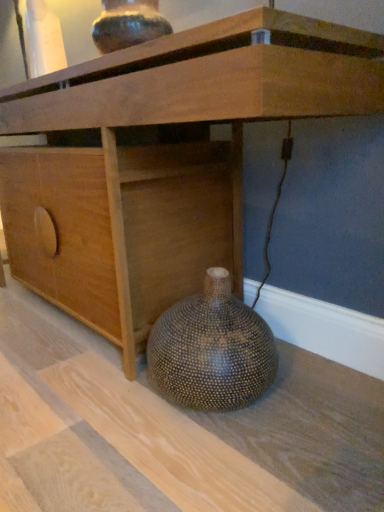
Question: Is speckled ceramic vase at upper center, which is the first vase from top to bottom, outside wooden cabinet at lower center?

Choices:
 (A) no
 (B) yes

Answer: (B)

Question: From the image's perspective, is speckled ceramic vase at upper center, which is the first vase from top to bottom, above wooden cabinet at lower center?

Choices:
 (A) no
 (B) yes

Answer: (B)

Question: Considering the relative sizes of speckled ceramic vase at upper center, the 2th vase when ordered from bottom to top, and wooden cabinet at lower center in the image provided, is speckled ceramic vase at upper center, the 2th vase when ordered from bottom to top, smaller than wooden cabinet at lower center?

Choices:
 (A) no
 (B) yes

Answer: (B)

Question: Is speckled ceramic vase at upper center, which is the first vase from top to bottom, positioned in front of wooden cabinet at lower center?

Choices:
 (A) yes
 (B) no

Answer: (B)

Question: Considering the relative positions of speckled ceramic vase at upper center, which is the first vase from top to bottom, and wooden cabinet at lower center in the image provided, is speckled ceramic vase at upper center, which is the first vase from top to bottom, to the right of wooden cabinet at lower center from the viewer's perspective?

Choices:
 (A) yes
 (B) no

Answer: (A)

Question: Is wooden cabinet at lower center to the left or to the right of speckled ceramic vase at upper center, which is the first vase from top to bottom, in the image?

Choices:
 (A) right
 (B) left

Answer: (B)

Question: Based on their sizes in the image, would you say wooden cabinet at lower center is bigger or smaller than speckled ceramic vase at upper center, which is the first vase from top to bottom?

Choices:
 (A) small
 (B) big

Answer: (B)

Question: From a real-world perspective, relative to speckled ceramic vase at upper center, the 2th vase when ordered from bottom to top, is wooden cabinet at lower center vertically above or below?

Choices:
 (A) above
 (B) below

Answer: (B)

Question: From the image's perspective, is wooden cabinet at lower center positioned above or below speckled ceramic vase at upper center, which is the first vase from top to bottom?

Choices:
 (A) below
 (B) above

Answer: (A)

Question: Based on their positions, is brown textured vase at lower right, the 1th vase in the bottom-to-top sequence, located to the left or right of speckled ceramic vase at upper center, the 2th vase when ordered from bottom to top?

Choices:
 (A) right
 (B) left

Answer: (A)

Question: Considering the positions of brown textured vase at lower right, which ranks as the 2th vase in top-to-bottom order, and speckled ceramic vase at upper center, the 2th vase when ordered from bottom to top, in the image, is brown textured vase at lower right, which ranks as the 2th vase in top-to-bottom order, taller or shorter than speckled ceramic vase at upper center, the 2th vase when ordered from bottom to top,?

Choices:
 (A) short
 (B) tall

Answer: (B)

Question: In the image, is brown textured vase at lower right, the 1th vase in the bottom-to-top sequence, positioned in front of or behind speckled ceramic vase at upper center, which is the first vase from top to bottom?

Choices:
 (A) behind
 (B) front

Answer: (B)

Question: Does point (269, 340) appear closer or farther from the camera than point (112, 48)?

Choices:
 (A) farther
 (B) closer

Answer: (B)

Question: Is speckled ceramic vase at upper center, which is the first vase from top to bottom, taller or shorter than brown textured vase at lower right, which ranks as the 2th vase in top-to-bottom order?

Choices:
 (A) tall
 (B) short

Answer: (B)

Question: Which is correct: speckled ceramic vase at upper center, which is the first vase from top to bottom, is inside brown textured vase at lower right, the 1th vase in the bottom-to-top sequence, or outside of it?

Choices:
 (A) outside
 (B) inside

Answer: (A)